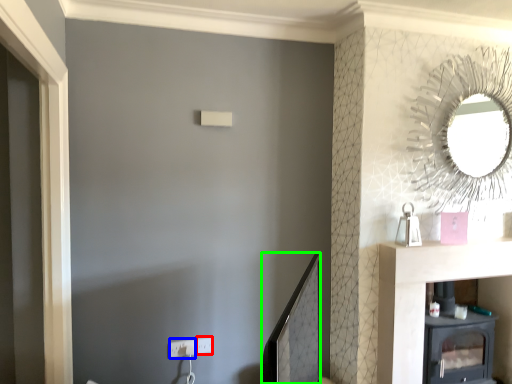
Question: Considering the real-world distances, which object is farthest from electric outlet (highlighted by a red box)? electric outlet (highlighted by a blue box) or mirror (highlighted by a green box)?

Choices:
 (A) electric outlet
 (B) mirror

Answer: (B)